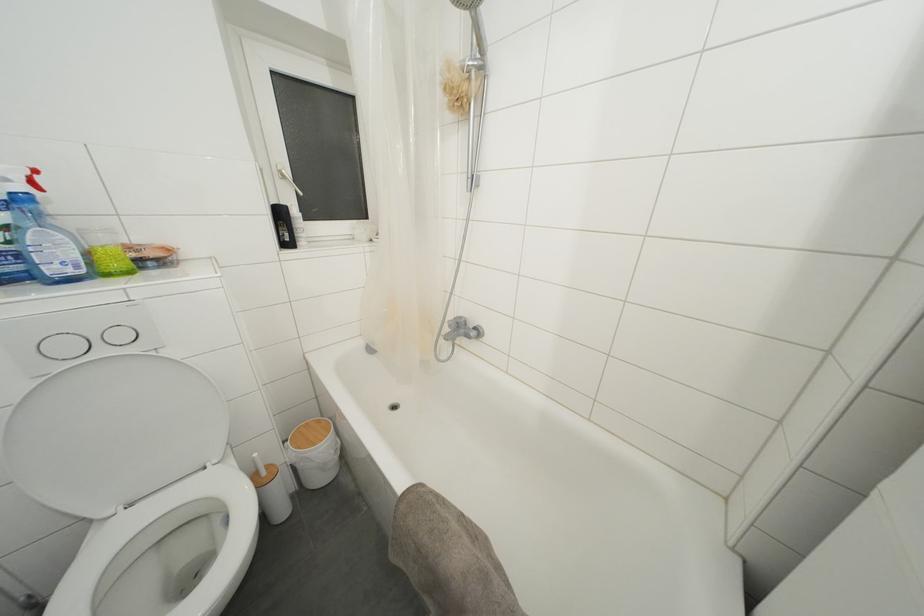
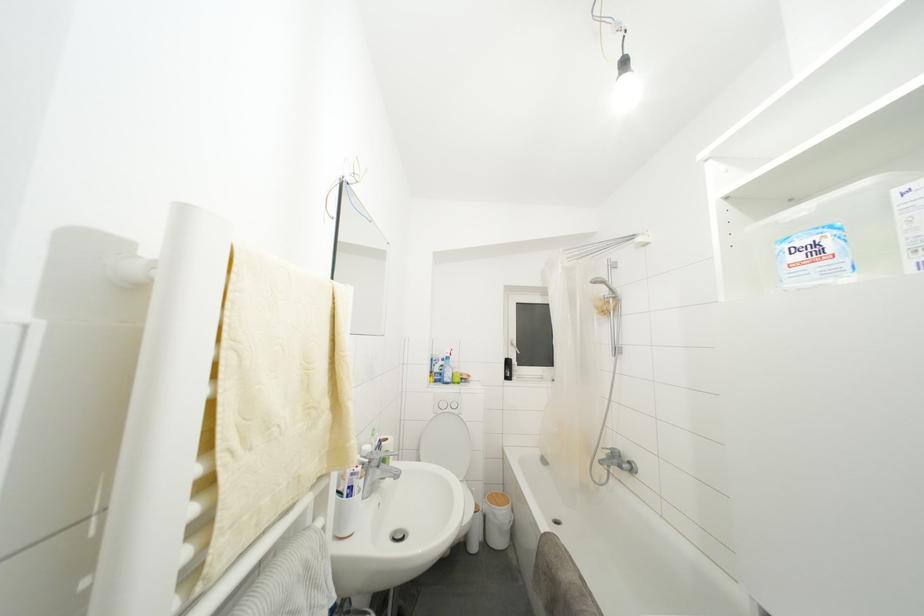
Consider the image. How did the camera likely rotate?

The camera's rotation is toward left-up.